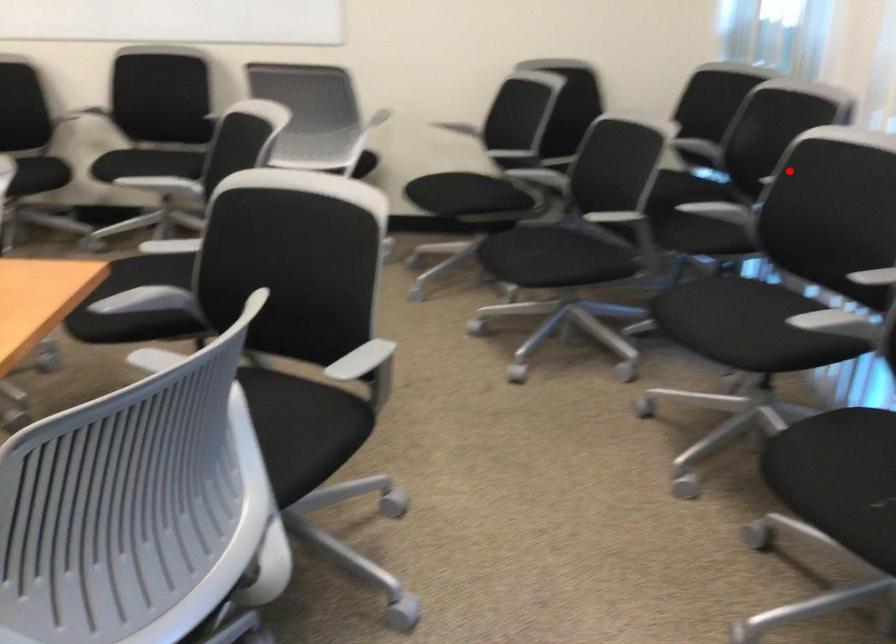
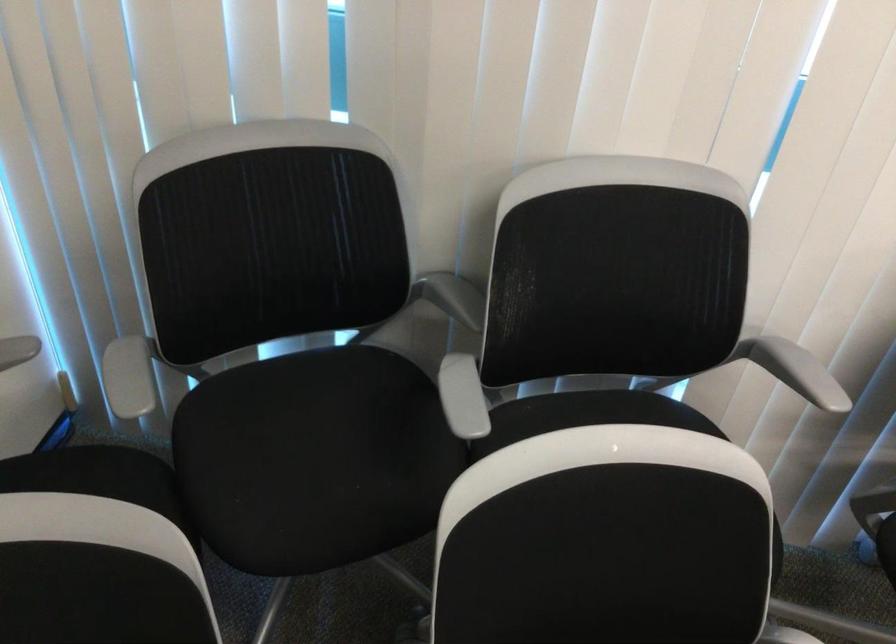
Question: I am providing you with two images of the same scene from different viewpoints. Image1 has a red point marked. In image2, the corresponding 3D location appears at what relative position? Reply with the corresponding letter.

Choices:
 (A) Closer
 (B) Farther

Answer: (A)